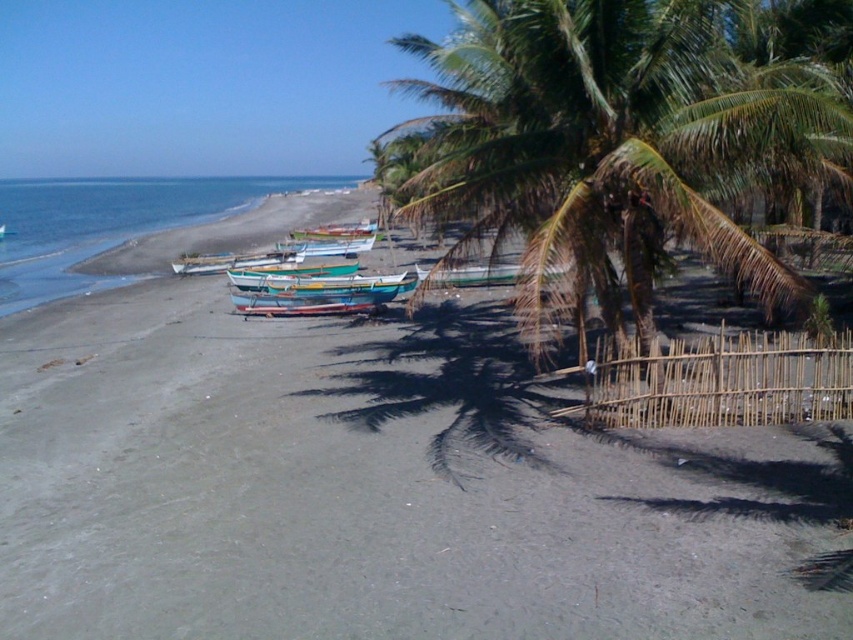
From the picture: Can you confirm if gray sand at center is positioned to the left of wooden boat at center?

Correct, you'll find gray sand at center to the left of wooden boat at center.

Does gray sand at center have a lesser width compared to wooden boat at center?

No, gray sand at center is not thinner than wooden boat at center.

Is point (556, 620) less distant than point (494, 284)?

Yes.

Find the location of `gray sand at center`. gray sand at center is located at coordinates (376, 488).

Which is behind, point (619, 148) or point (316, 188)?

The point (316, 188) is behind.

Image resolution: width=853 pixels, height=640 pixels. Describe the element at coordinates (614, 145) in the screenshot. I see `green leafy coconut tree at center` at that location.

I want to click on green leafy coconut tree at center, so click(614, 145).

Is gray sand at center positioned before green painted wooden boat at center?

Yes.

Is gray sand at center to the right of green painted wooden boat at center from the viewer's perspective?

Yes, gray sand at center is to the right of green painted wooden boat at center.

At what (x,y) coordinates should I click in order to perform the action: click on gray sand at center. Please return your answer as a coordinate pair (x, y). This screenshot has height=640, width=853. Looking at the image, I should click on (376, 488).